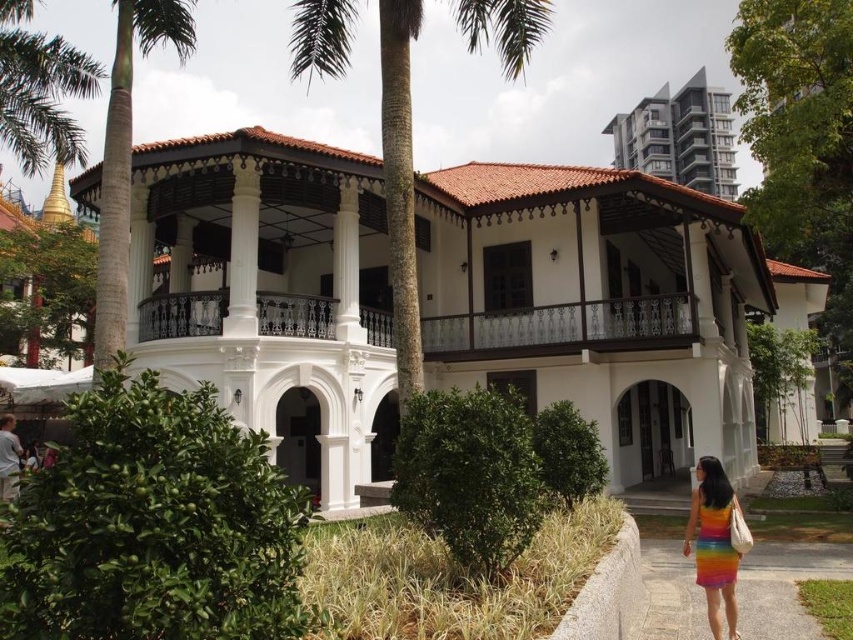
You are standing in front of the colonial building and notice the green leafy palm tree at upper left and the matte gray building at upper right. Which object is closer to you?

The green leafy palm tree at upper left is closer to you because it is in front of the matte gray building at upper right.